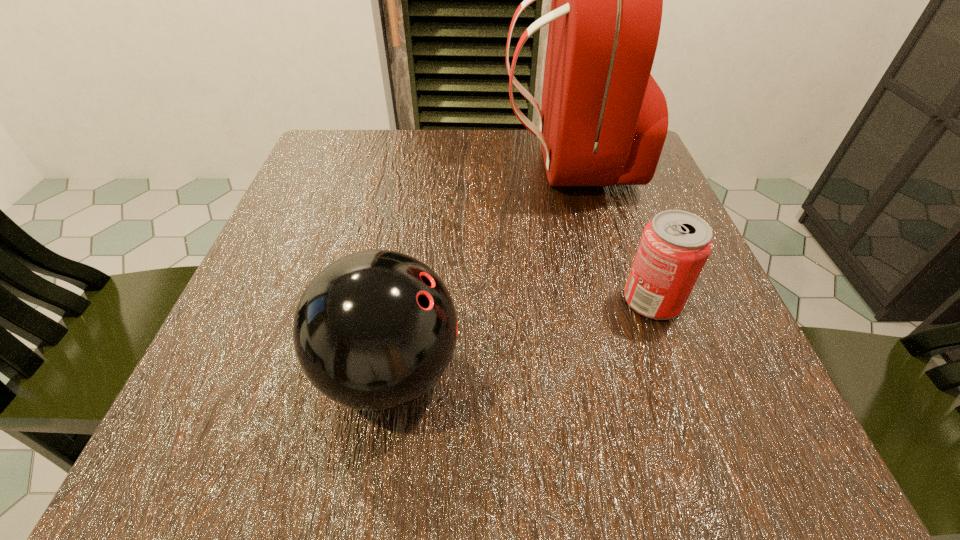
Locate an element on the screen. The height and width of the screenshot is (540, 960). backpack is located at coordinates (603, 121).

Where is `the farthest object`? the farthest object is located at coordinates (603, 121).

In order to click on the leftmost object in this screenshot , I will do `click(374, 330)`.

This screenshot has width=960, height=540. I want to click on bowling ball, so click(x=374, y=330).

This screenshot has width=960, height=540. I want to click on soda can, so click(x=675, y=245).

Image resolution: width=960 pixels, height=540 pixels. Identify the location of vacant space located on the strap side of the farthest object. (433, 164).

The width and height of the screenshot is (960, 540). I want to click on vacant space located on the strap side of the farthest object, so click(470, 164).

Locate an element on the screen. vacant region located 0.260m on the strap side of the farthest object is located at coordinates (382, 164).

You are a GUI agent. You are given a task and a screenshot of the screen. Output one action in this format:
    pyautogui.click(x=<x>, y=<y>)
    Task: Click on the vacant space located 0.220m on the surface of the leftmost object near the finger holes
    
    Given the screenshot: What is the action you would take?
    pyautogui.click(x=625, y=372)

Where is `vacant space located on the front of the shortest object`? This screenshot has height=540, width=960. vacant space located on the front of the shortest object is located at coordinates (678, 370).